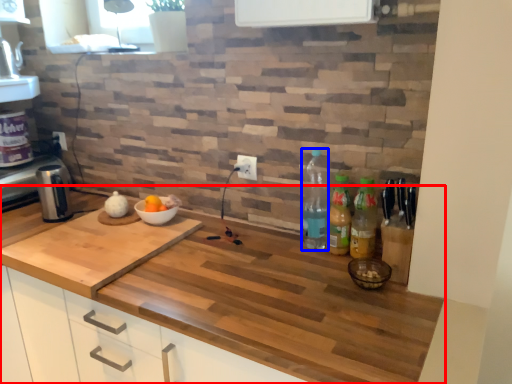
Question: Which of the following is the farthest to the observer, countertop (highlighted by a red box) or bottle (highlighted by a blue box)?

Choices:
 (A) countertop
 (B) bottle

Answer: (B)